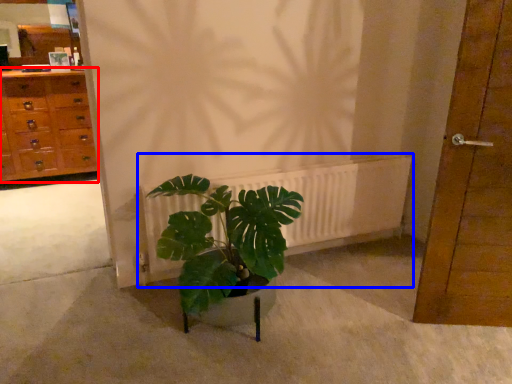
Question: Which of the following is the farthest to the observer, chest of drawers (highlighted by a red box) or radiator (highlighted by a blue box)?

Choices:
 (A) chest of drawers
 (B) radiator

Answer: (A)